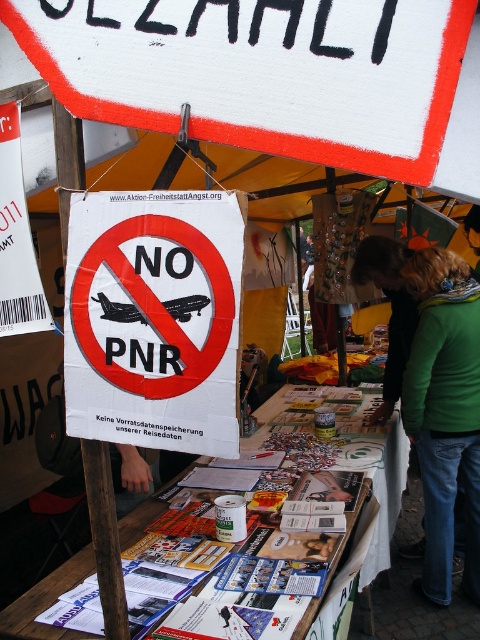
Consider the image. You are standing at the protest stall and want to place a new sign on the table. The table is at point (262, 72). Where should you place the new sign so it doesn

The yellow fabric canopy at upper center is located at point (262, 72). To avoid blocking the canopy, place the new sign elsewhere on the table.

You are at an event and want to read the white paper sign at center, but there is a green fabric jacket at lower right in the way. Can you see the entire sign?

The white paper sign at center has a lesser height compared to green fabric jacket at lower right, so the jacket may block part of the sign depending on their positions. Since the jacket is at lower right and the sign is at center, the lower part of the sign might be obscured by the jacket.